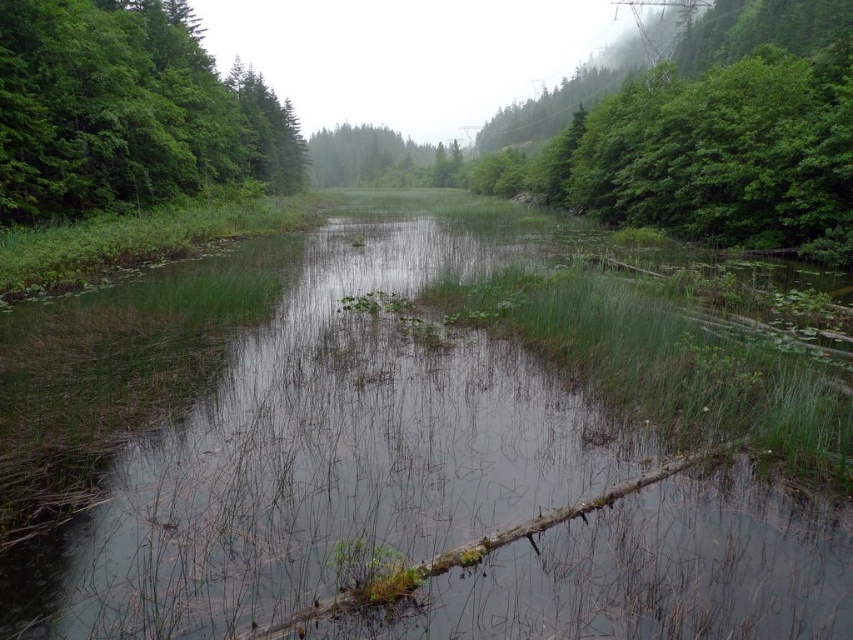
Which is below, green leafy tree at upper right or green leafy tree at left?

green leafy tree at left

Which is behind, point (608, 186) or point (28, 58)?

Point (608, 186)

Where is `green leafy tree at upper right`? Image resolution: width=853 pixels, height=640 pixels. green leafy tree at upper right is located at coordinates (717, 136).

Is green grassy stream at center smaller than green leafy tree at upper right?

Correct, green grassy stream at center occupies less space than green leafy tree at upper right.

Consider the image. Which of these two, green grassy stream at center or green leafy tree at upper right, stands taller?

Standing taller between the two is green leafy tree at upper right.

You are a GUI agent. You are given a task and a screenshot of the screen. Output one action in this format:
    pyautogui.click(x=<x>, y=<y>)
    Task: Click on the green grassy stream at center
    This screenshot has height=640, width=853.
    Given the screenshot: What is the action you would take?
    coord(315,435)

Who is positioned more to the right, green leafy tree at left or green leafy tree at center?

green leafy tree at center

Describe the element at coordinates (126, 109) in the screenshot. I see `green leafy tree at left` at that location.

Does point (68, 129) lie in front of point (431, 148)?

Yes.

Locate an element on the screen. This screenshot has width=853, height=640. green leafy tree at left is located at coordinates (126, 109).